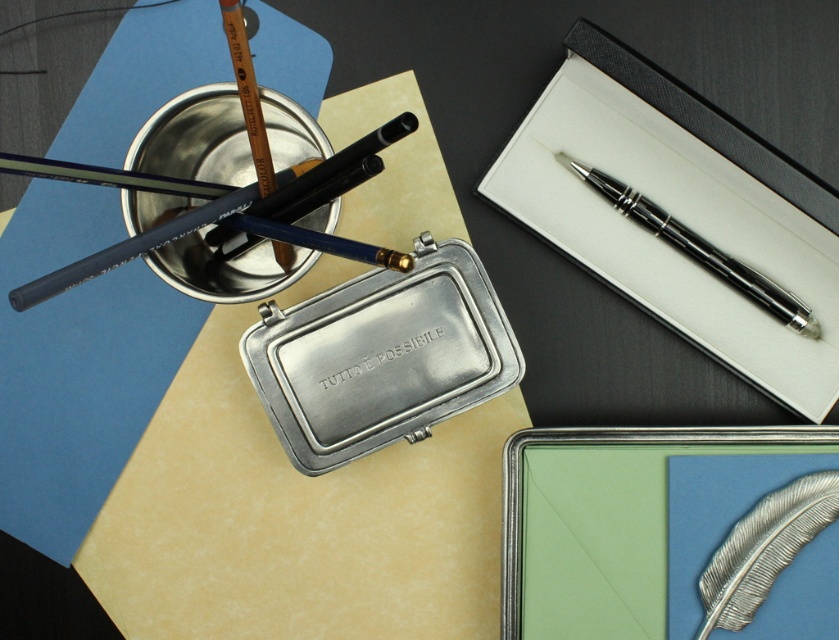
This screenshot has height=640, width=839. I want to click on matte black pencil at upper left, so (227, 209).

Locate an element on the screen. The width and height of the screenshot is (839, 640). metallic pen at upper right is located at coordinates (678, 212).

Can you confirm if metallic pen at upper right is positioned to the right of polished black pen at upper right?

Yes, metallic pen at upper right is to the right of polished black pen at upper right.

Does point (567, 77) lie behind point (733, 285)?

No.

Where is `metallic pen at upper right`? The height and width of the screenshot is (640, 839). metallic pen at upper right is located at coordinates (678, 212).

Who is shorter, metallic pen at upper right or matte black pencil at upper left?

Standing shorter between the two is matte black pencil at upper left.

Image resolution: width=839 pixels, height=640 pixels. Describe the element at coordinates (678, 212) in the screenshot. I see `metallic pen at upper right` at that location.

You are a GUI agent. You are given a task and a screenshot of the screen. Output one action in this format:
    pyautogui.click(x=<x>, y=<y>)
    Task: Click on the metallic pen at upper right
    The image size is (839, 640).
    Given the screenshot: What is the action you would take?
    pyautogui.click(x=678, y=212)